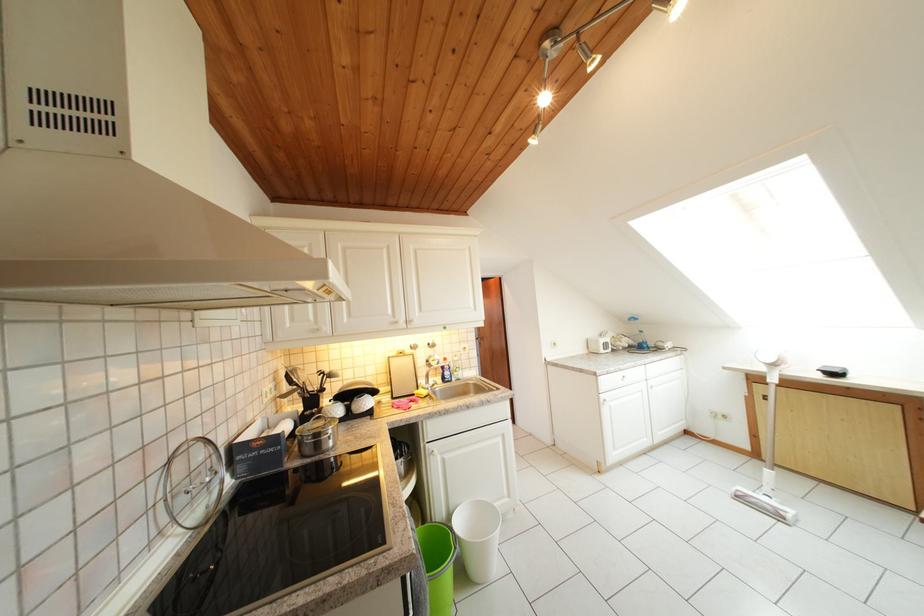
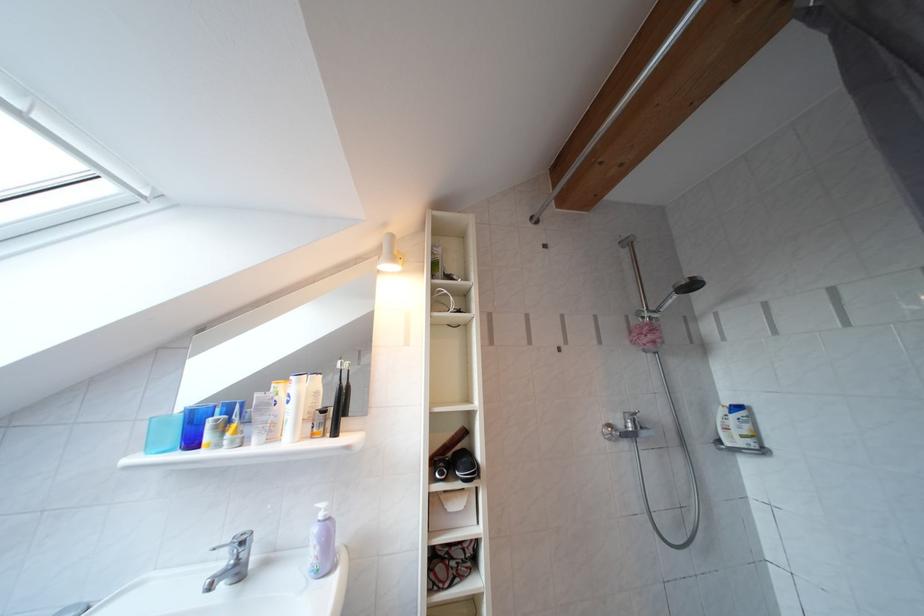
Question: In a continuous first-person perspective shot, in which direction is the camera moving?

Choices:
 (A) Left
 (B) Right
 (C) Forward
 (D) Backward

Answer: (C)